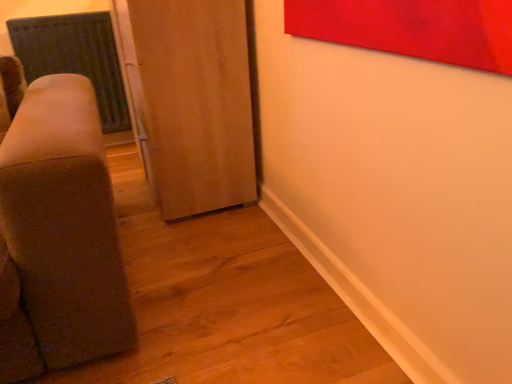
Question: Is satin green radiator at left surrounded by wooden door at center?

Choices:
 (A) no
 (B) yes

Answer: (A)

Question: Is wooden door at center bigger than satin green radiator at left?

Choices:
 (A) yes
 (B) no

Answer: (A)

Question: Is wooden door at center oriented towards satin green radiator at left?

Choices:
 (A) yes
 (B) no

Answer: (B)

Question: Does wooden door at center have a greater width compared to satin green radiator at left?

Choices:
 (A) no
 (B) yes

Answer: (B)

Question: Does wooden door at center lie in front of satin green radiator at left?

Choices:
 (A) yes
 (B) no

Answer: (A)

Question: Considering the relative sizes of wooden door at center and satin green radiator at left in the image provided, is wooden door at center smaller than satin green radiator at left?

Choices:
 (A) yes
 (B) no

Answer: (B)

Question: Does satin green radiator at left contain wooden door at center?

Choices:
 (A) no
 (B) yes

Answer: (A)

Question: Is satin green radiator at left looking in the opposite direction of wooden door at center?

Choices:
 (A) yes
 (B) no

Answer: (B)

Question: From the image's perspective, would you say satin green radiator at left is shown under wooden door at center?

Choices:
 (A) yes
 (B) no

Answer: (B)

Question: Is satin green radiator at left at the left side of wooden door at center?

Choices:
 (A) yes
 (B) no

Answer: (A)

Question: Is the depth of satin green radiator at left greater than that of wooden door at center?

Choices:
 (A) yes
 (B) no

Answer: (A)

Question: From a real-world perspective, is satin green radiator at left beneath wooden door at center?

Choices:
 (A) no
 (B) yes

Answer: (A)

Question: Is wooden door at center spatially inside satin green radiator at left, or outside of it?

Choices:
 (A) inside
 (B) outside

Answer: (B)